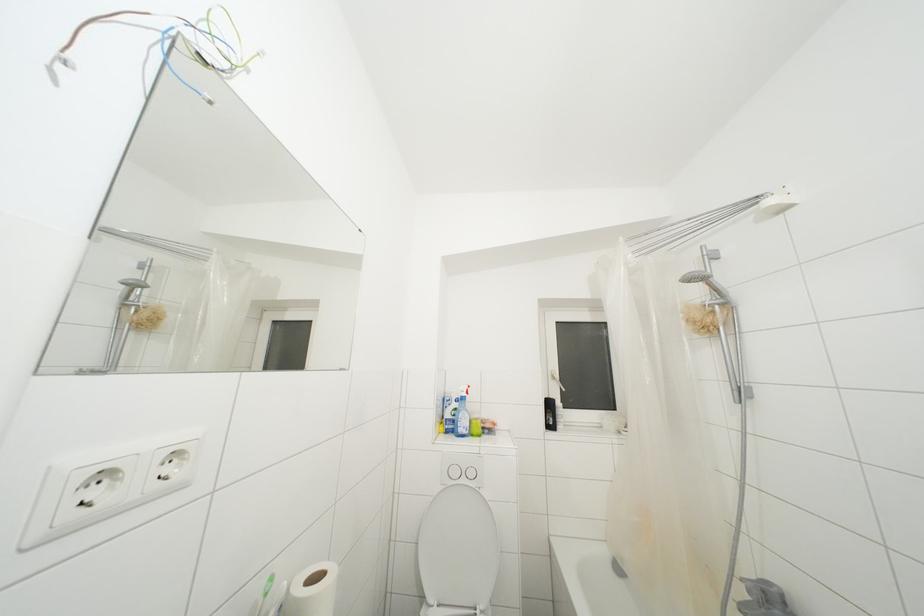
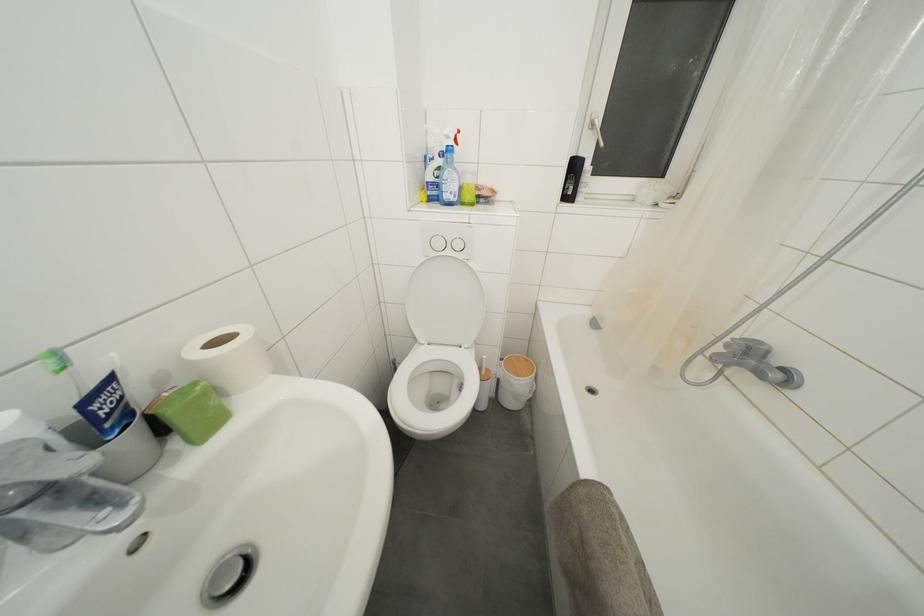
In the second image, find the point that corresponds to (276,582) in the first image.

(61, 359)